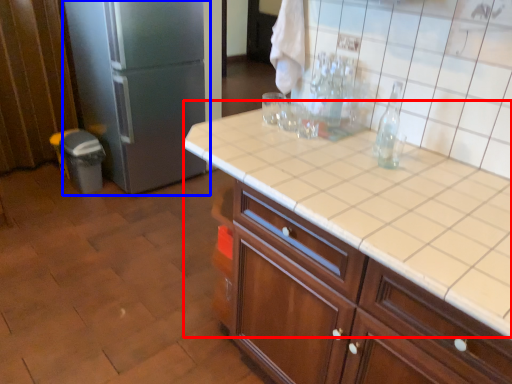
Question: Which point is further to the camera, table (highlighted by a red box) or refrigerator (highlighted by a blue box)?

Choices:
 (A) table
 (B) refrigerator

Answer: (B)